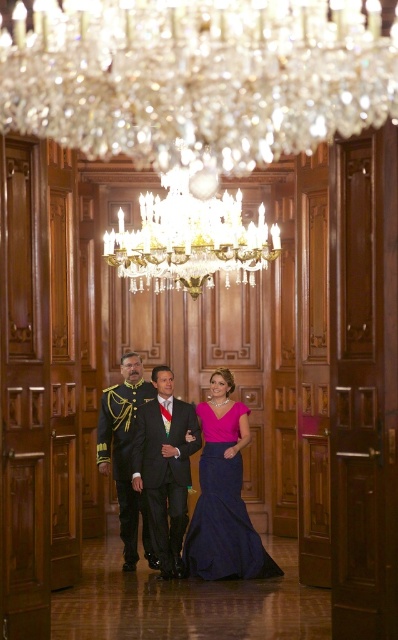
Question: In this image, where is shiny navy blue gown at center located relative to navy satin gown at center?

Choices:
 (A) below
 (B) above

Answer: (B)

Question: Is crystal glass chandelier at upper center to the left of shiny gold uniform at center from the viewer's perspective?

Choices:
 (A) yes
 (B) no

Answer: (B)

Question: Which point is farther to the camera?

Choices:
 (A) crystal glass chandelier at upper center
 (B) navy satin gown at center

Answer: (B)

Question: Where is crystal glass chandelier at upper center located in relation to shiny navy blue gown at center in the image?

Choices:
 (A) above
 (B) below

Answer: (A)

Question: Which is farther from the shiny gold uniform at center?

Choices:
 (A) navy satin gown at center
 (B) shiny navy blue gown at center

Answer: (A)

Question: Which of the following is the closest to the observer?

Choices:
 (A) crystal glass chandelier at upper center
 (B) shiny navy blue gown at center
 (C) shiny black suit at center

Answer: (A)